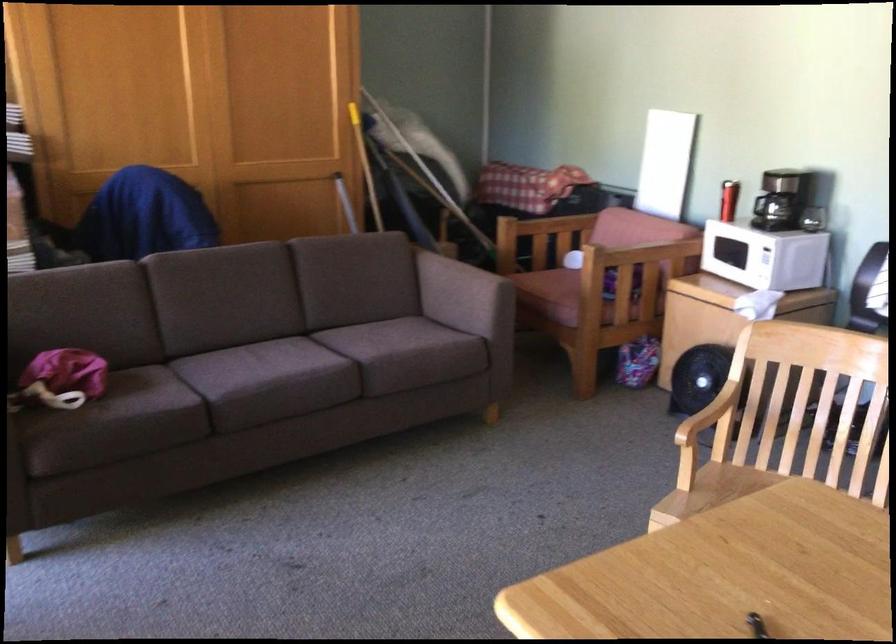
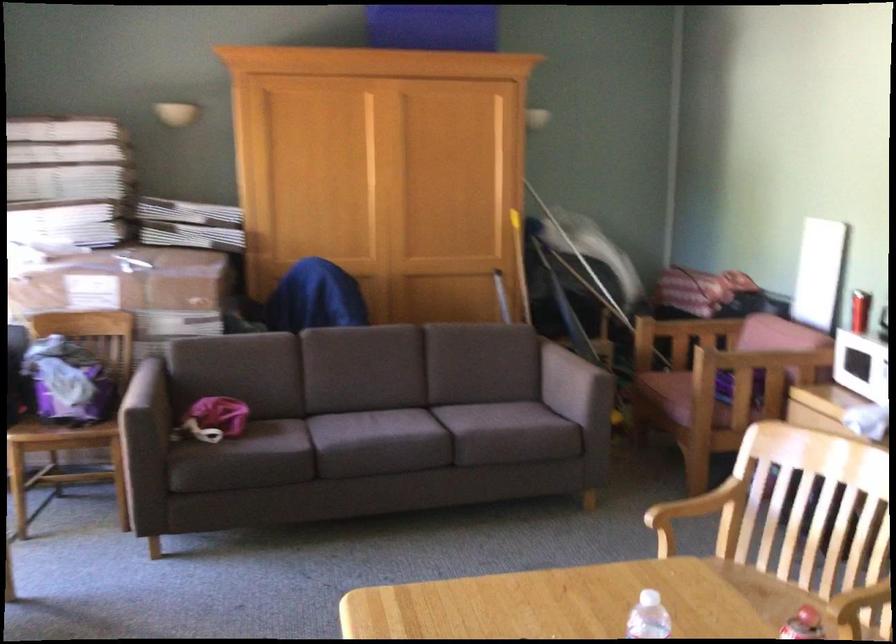
Question: The camera is either moving clockwise (left) or counter-clockwise (right) around the object. The first image is from the beginning of the video and the second image is from the end. Is the camera moving left or right when shooting the video?

Choices:
 (A) Left
 (B) Right

Answer: (B)